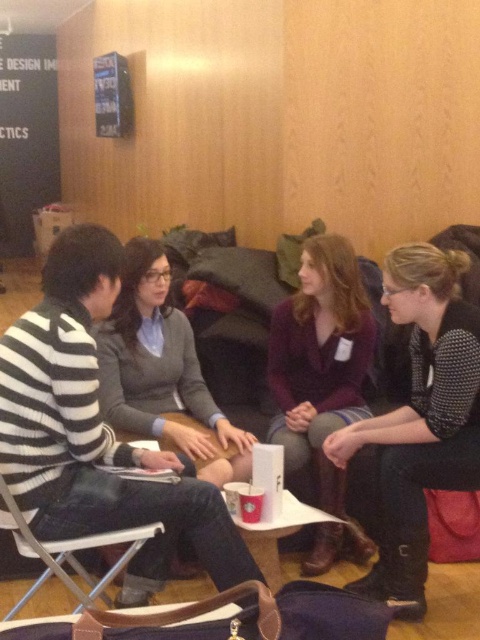
Question: Is black dotted shirt at right wider than metallic silver folding chair at lower left?

Choices:
 (A) yes
 (B) no

Answer: (B)

Question: Among these objects, which one is nearest to the camera?

Choices:
 (A) metallic silver folding chair at lower left
 (B) matte gray sweater at center
 (C) black dotted shirt at right

Answer: (A)

Question: Can you confirm if black dotted shirt at right is positioned to the right of purple velvet blazer at center?

Choices:
 (A) no
 (B) yes

Answer: (B)

Question: Estimate the real-world distances between objects in this image. Which object is closer to the metallic silver folding chair at lower left?

Choices:
 (A) black dotted shirt at right
 (B) matte gray sweater at center

Answer: (B)

Question: Which point is farther to the camera?

Choices:
 (A) (108, 582)
 (B) (422, 584)
 (C) (214, 429)
 (D) (335, 394)

Answer: (D)

Question: Is matte gray sweater at center below metallic silver folding chair at lower left?

Choices:
 (A) yes
 (B) no

Answer: (B)